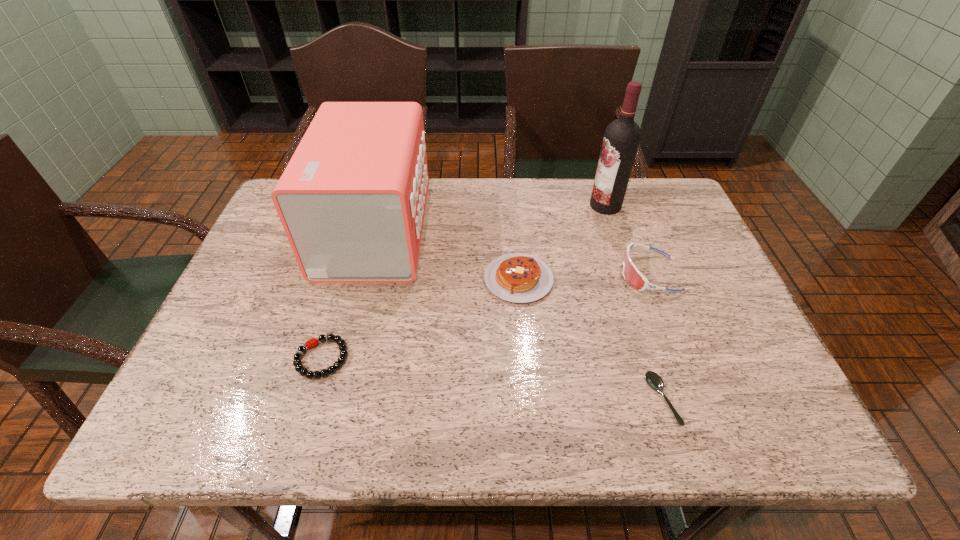
Identify the location of vacant space that satisfies the following two spatial constraints: 1. on the front-facing side of the third tallest object; 2. on the front side of the second shortest object. (682, 358).

You are a GUI agent. You are given a task and a screenshot of the screen. Output one action in this format:
    pyautogui.click(x=<x>, y=<y>)
    Task: Click on the blank area in the image that satisfies the following two spatial constraints: 1. on the label of the tallest object; 2. on the front side of the third object from left to right
    
    Given the screenshot: What is the action you would take?
    pyautogui.click(x=630, y=279)

The width and height of the screenshot is (960, 540). Find the location of `vacant space that satisfies the following two spatial constraints: 1. on the surface of the second tallest object where the text is embossed; 2. on the front side of the second shortest object`. vacant space that satisfies the following two spatial constraints: 1. on the surface of the second tallest object where the text is embossed; 2. on the front side of the second shortest object is located at coordinates (342, 358).

Locate an element on the screen. This screenshot has height=540, width=960. free location that satisfies the following two spatial constraints: 1. on the surface of the box where the text is embossed; 2. on the left side of the soupspoon is located at coordinates (331, 400).

Find the location of a particular element. The image size is (960, 540). blank area in the image that satisfies the following two spatial constraints: 1. on the surface of the soupspoon where the text is embossed; 2. on the left side of the box is located at coordinates (331, 400).

Where is `vacant space that satisfies the following two spatial constraints: 1. on the back side of the third object from left to right; 2. on the surface of the box where the text is embossed`? This screenshot has height=540, width=960. vacant space that satisfies the following two spatial constraints: 1. on the back side of the third object from left to right; 2. on the surface of the box where the text is embossed is located at coordinates (515, 230).

This screenshot has height=540, width=960. Find the location of `vacant space that satisfies the following two spatial constraints: 1. on the surface of the fourth object from right to left where the text is embossed; 2. on the left side of the second tallest object`. vacant space that satisfies the following two spatial constraints: 1. on the surface of the fourth object from right to left where the text is embossed; 2. on the left side of the second tallest object is located at coordinates (362, 279).